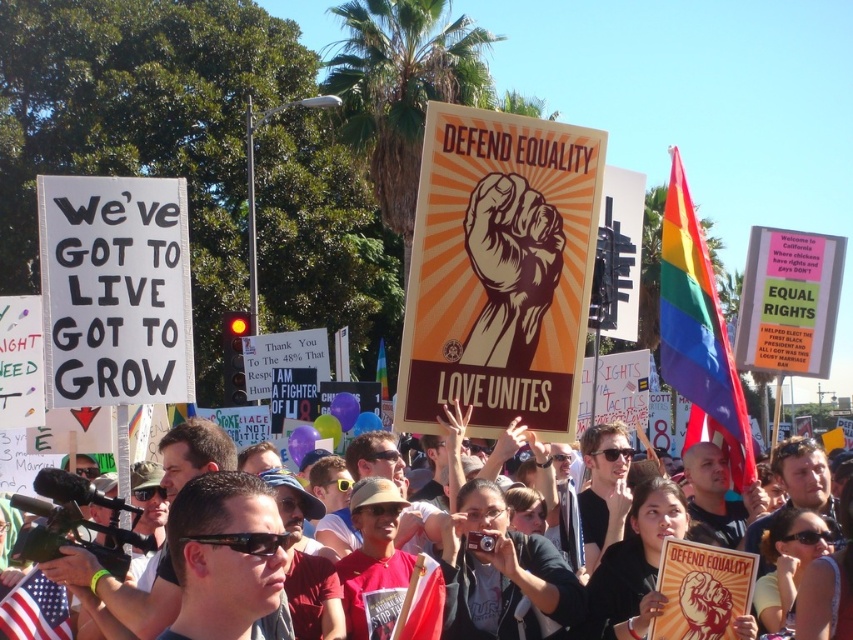
You are a photographer standing at the edge of the protest crowd. You want to take a clear photo of the matte black sign at center. Considering the distance between you and the sign, is it feasible to capture a sharp image without using a zoom lens?

The matte black sign at center is 35.03 meters away from the viewer. Without a zoom lens, capturing a sharp image from this distance may be challenging as standard lenses typically require closer proximity for clarity. A zoom lens would be necessary to ensure the sign is in focus and clear.

You are a photographer at the protest scene. You want to capture a photo that includes both the white paper sign at left and the american flag at lower left. Which object should you focus on first to ensure both are in frame?

You should focus on the white paper sign at left first because it is larger than the american flag at lower left, so it will require more space in the frame.

You are a photographer at the protest scene. You want to take a photo that includes both the matte black sign at center and the american flag at lower left. Which object should be placed closer to the bottom of the frame to ensure both are visible?

The american flag at lower left should be placed closer to the bottom of the frame because the matte black sign at center is taller and needs more vertical space to be fully visible.